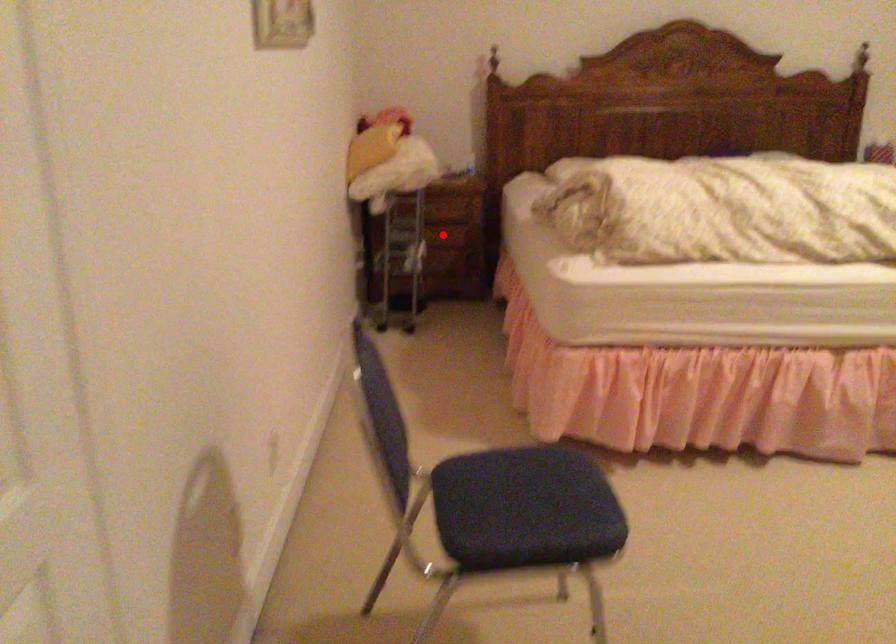
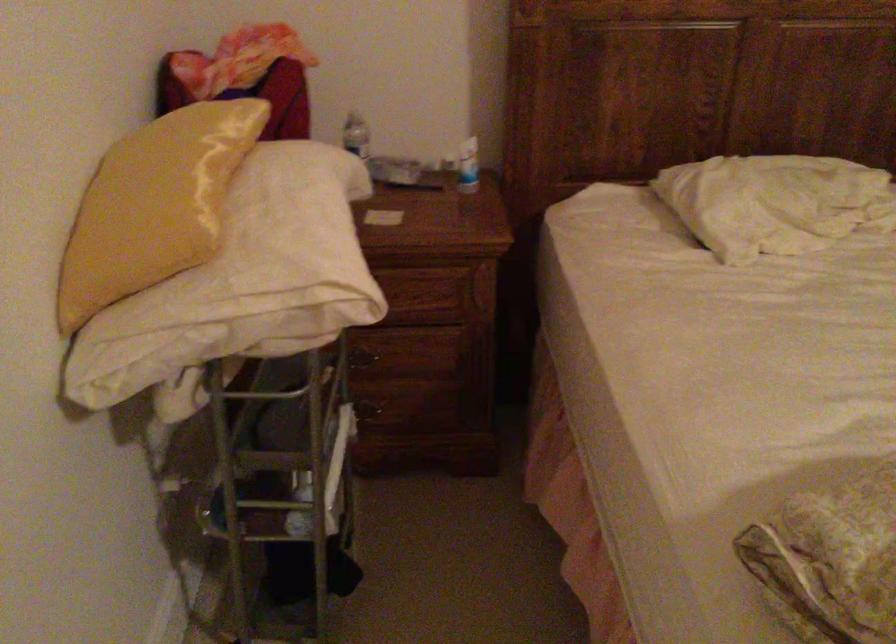
The point at the highlighted location is marked in the first image. Where is the corresponding point in the second image?

(412, 365)